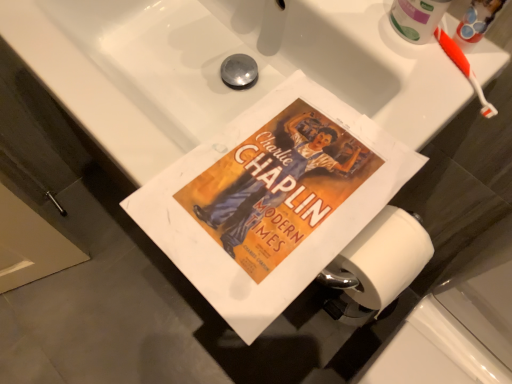
Question: From a real-world perspective, does matte paper poster at center stand above orange plastic toothbrush at upper right?

Choices:
 (A) no
 (B) yes

Answer: (A)

Question: Is matte paper poster at center next to orange plastic toothbrush at upper right?

Choices:
 (A) yes
 (B) no

Answer: (B)

Question: Is matte paper poster at center oriented away from orange plastic toothbrush at upper right?

Choices:
 (A) yes
 (B) no

Answer: (A)

Question: From the image's perspective, does matte paper poster at center appear higher than orange plastic toothbrush at upper right?

Choices:
 (A) yes
 (B) no

Answer: (B)

Question: Does matte paper poster at center have a smaller size compared to orange plastic toothbrush at upper right?

Choices:
 (A) no
 (B) yes

Answer: (A)

Question: Is matte paper poster at center not inside orange plastic toothbrush at upper right?

Choices:
 (A) yes
 (B) no

Answer: (A)

Question: Is matte paper poster at center inside orange plastic toothbrush at upper right?

Choices:
 (A) yes
 (B) no

Answer: (B)

Question: Is the position of orange plastic toothbrush at upper right more distant than that of matte paper poster at center?

Choices:
 (A) no
 (B) yes

Answer: (B)

Question: From a real-world perspective, is orange plastic toothbrush at upper right physically above matte paper poster at center?

Choices:
 (A) no
 (B) yes

Answer: (B)

Question: Is orange plastic toothbrush at upper right with matte paper poster at center?

Choices:
 (A) no
 (B) yes

Answer: (A)

Question: Can you confirm if orange plastic toothbrush at upper right is thinner than matte paper poster at center?

Choices:
 (A) yes
 (B) no

Answer: (A)

Question: Can you confirm if orange plastic toothbrush at upper right is positioned to the right of matte paper poster at center?

Choices:
 (A) no
 (B) yes

Answer: (B)

Question: Visually, is matte paper poster at center positioned to the left or to the right of orange plastic toothbrush at upper right?

Choices:
 (A) right
 (B) left

Answer: (B)